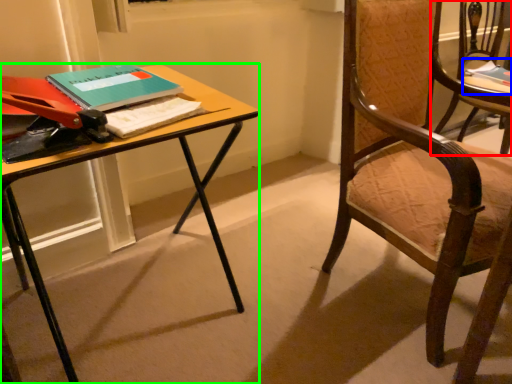
Question: Which is farther away from chair (highlighted by a red box)? book (highlighted by a blue box) or desk (highlighted by a green box)?

Choices:
 (A) book
 (B) desk

Answer: (B)